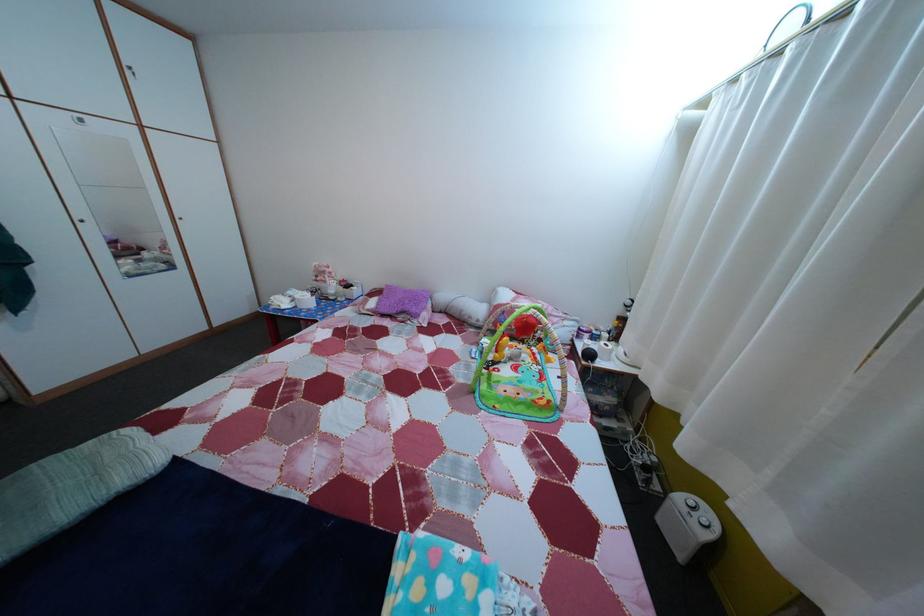
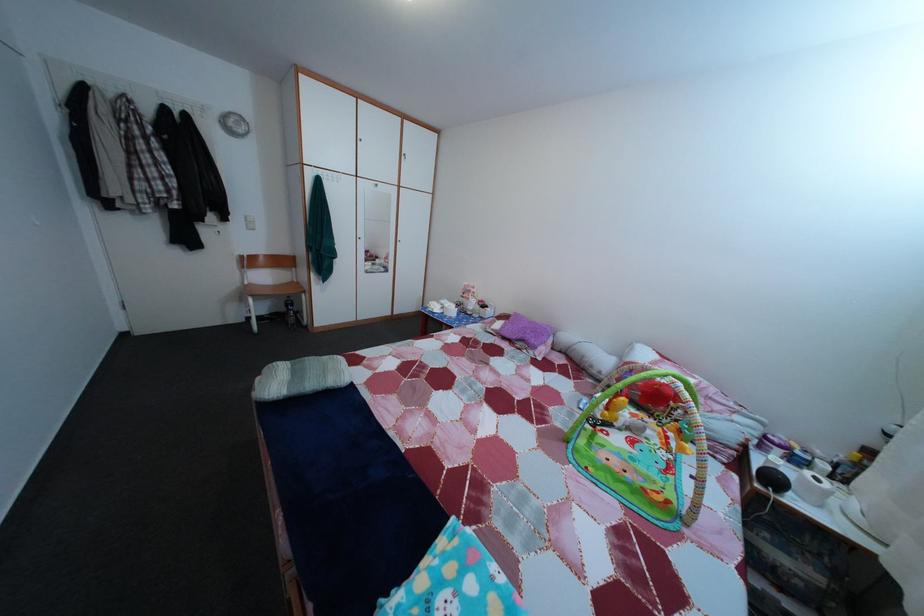
Question: The camera is either moving clockwise (left) or counter-clockwise (right) around the object. The first image is from the beginning of the video and the second image is from the end. Is the camera moving left or right when shooting the video?

Choices:
 (A) Left
 (B) Right

Answer: (B)